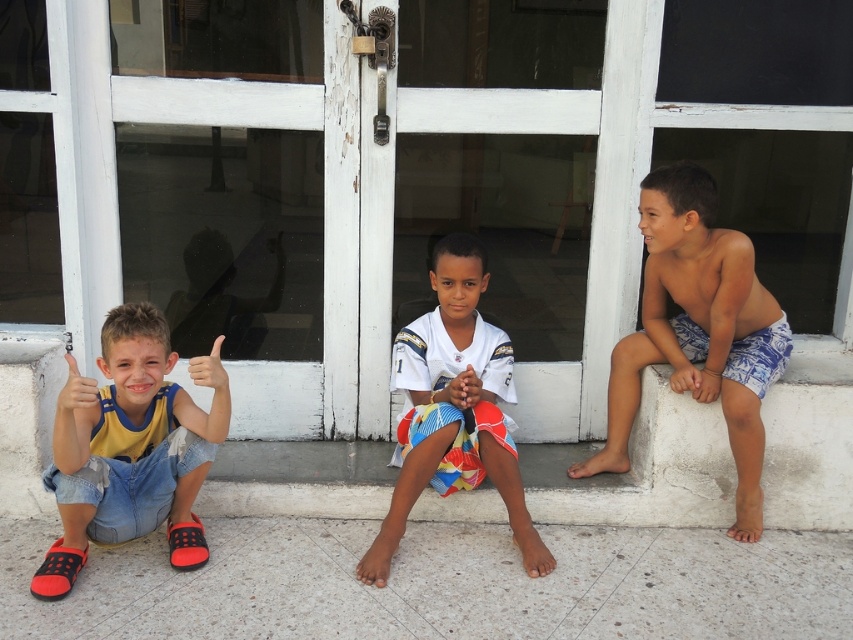
You are a tailor measuring the shorts of two boys. The first boy is wearing denim shorts at left, and the second has blue printed shorts at right. Which pair of shorts is wider?

The blue printed shorts at right are wider than the denim shorts at left.

You are a photographer trying to capture a group shot of the three boys. You want to ensure that the denim shorts at left and white jersey at center are both visible in the frame. Based on their positions, which direction should you move the camera to include both in the shot?

Since the denim shorts at left is to the left of white jersey at center, you should move the camera slightly to the left to ensure both the denim shorts at left and white jersey at center are visible in the frame.

You are a photographer trying to capture a group photo of the blue printed shorts at right and the white jersey at center. Since you want to ensure both subjects are in focus, you need to know which one is bigger. Which object is larger?

The blue printed shorts at right is larger compared to the white jersey at center according to the description.